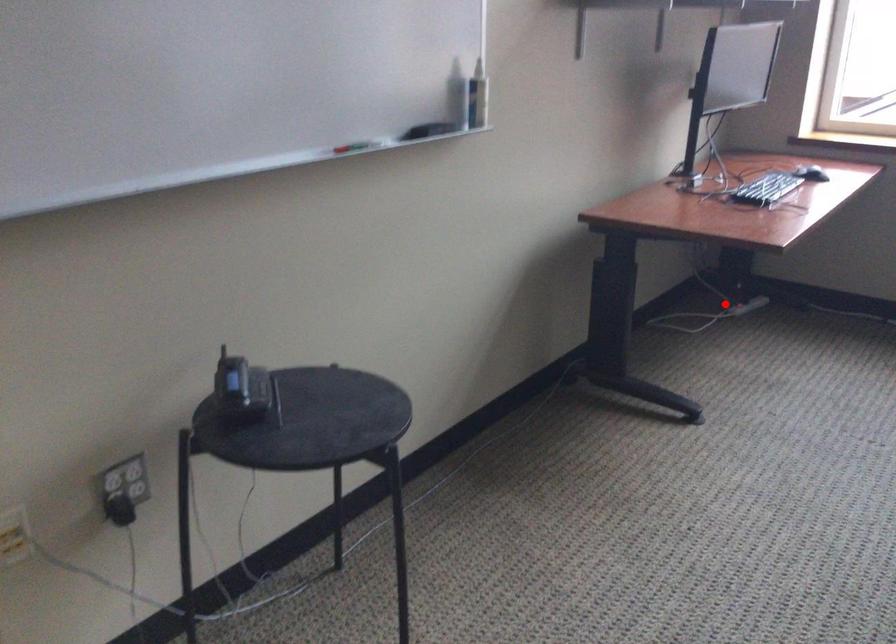
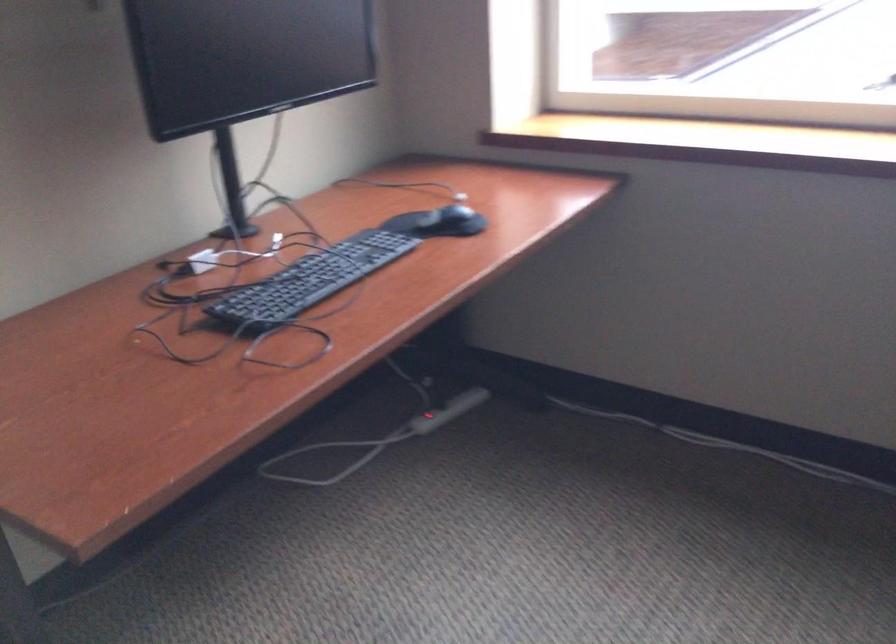
Question: I am providing you with two images of the same scene from different viewpoints. A red point is shown in image1. For the corresponding object point in image2, is it positioned nearer or farther from the camera?

Choices:
 (A) Nearer
 (B) Farther

Answer: (A)